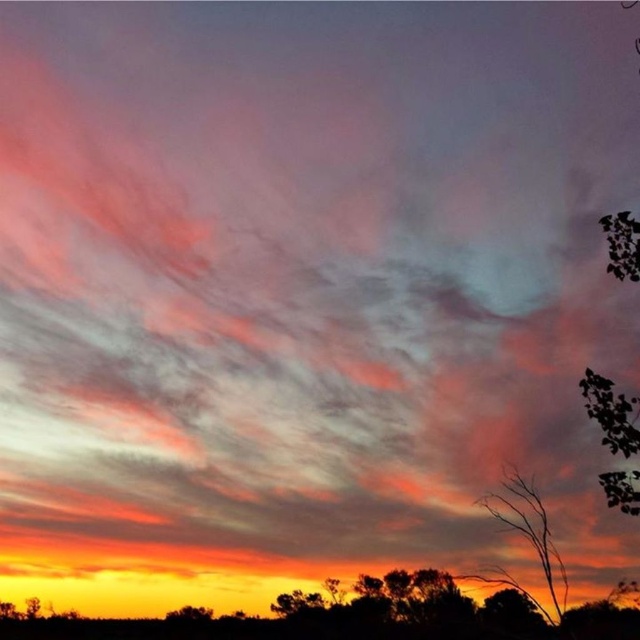
Between silhouette bare tree at lower right and green leafy tree at lower center, which one appears on the right side from the viewer's perspective?

Positioned to the right is silhouette bare tree at lower right.

From the picture: Is silhouette bare tree at lower right closer to camera compared to green leafy tree at lower center?

Yes.

Which is in front, point (524, 483) or point (305, 605)?

Point (524, 483)

Locate an element on the screen. This screenshot has height=640, width=640. silhouette bare tree at lower right is located at coordinates (525, 540).

The width and height of the screenshot is (640, 640). Find the location of `green leafy tree at upper right`. green leafy tree at upper right is located at coordinates (611, 413).

Is point (580, 385) positioned after point (296, 609)?

No.

This screenshot has width=640, height=640. In order to click on green leafy tree at upper right in this screenshot , I will do `click(611, 413)`.

Which is in front, point (595, 372) or point (525, 502)?

Point (595, 372) is more forward.

Between green leafy tree at upper right and silhouette bare tree at lower right, which one is positioned higher?

green leafy tree at upper right

In order to click on green leafy tree at upper right in this screenshot , I will do `click(611, 413)`.